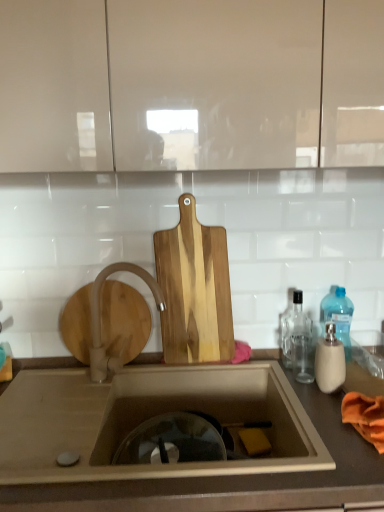
You are a GUI agent. You are given a task and a screenshot of the screen. Output one action in this format:
    pyautogui.click(x=<x>, y=<y>)
    Task: Click on the free space in front of blue translucent bottle at right, the 1th bottle in the back-to-front sequence
    
    Given the screenshot: What is the action you would take?
    pyautogui.click(x=351, y=380)